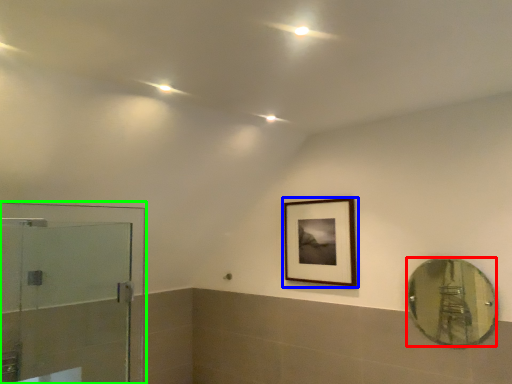
Question: Based on their relative distances, which object is farther from mirror (highlighted by a red box)? Choose from picture frame (highlighted by a blue box) and screen door (highlighted by a green box).

Choices:
 (A) picture frame
 (B) screen door

Answer: (B)